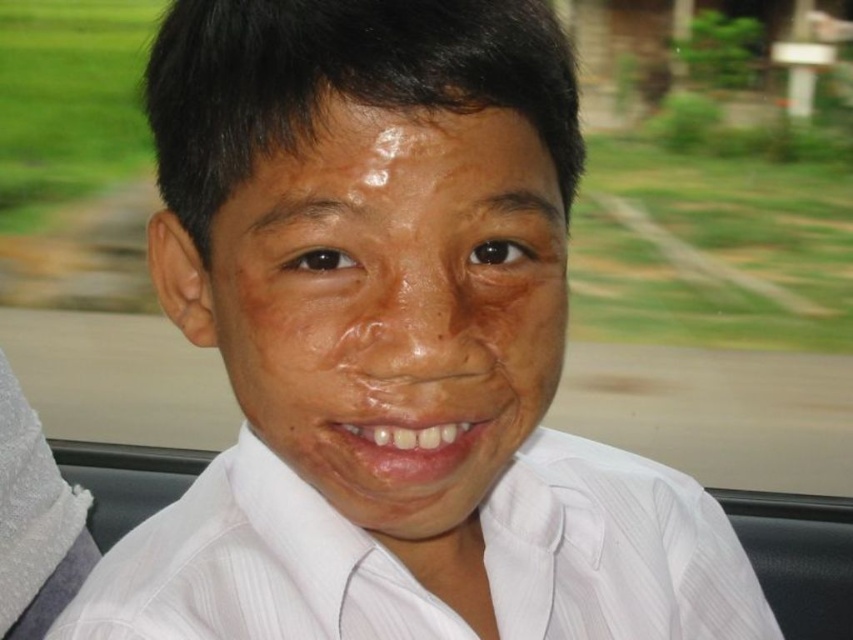
Question: Among these objects, which one is farthest from the camera?

Choices:
 (A) smooth skin face at center
 (B) dry skin at center
 (C) white striped dress shirt at center

Answer: (C)

Question: Is smooth skin face at center to the left of white striped dress shirt at center from the viewer's perspective?

Choices:
 (A) yes
 (B) no

Answer: (A)

Question: Which of the following is the closest to the observer?

Choices:
 (A) [599, 584]
 (B) [526, 196]

Answer: (B)

Question: Can you confirm if white striped dress shirt at center is positioned below dry skin at center?

Choices:
 (A) yes
 (B) no

Answer: (A)

Question: Which of the following is the farthest from the observer?

Choices:
 (A) [390, 205]
 (B) [416, 371]

Answer: (B)

Question: Is white striped dress shirt at center thinner than dry skin at center?

Choices:
 (A) yes
 (B) no

Answer: (B)